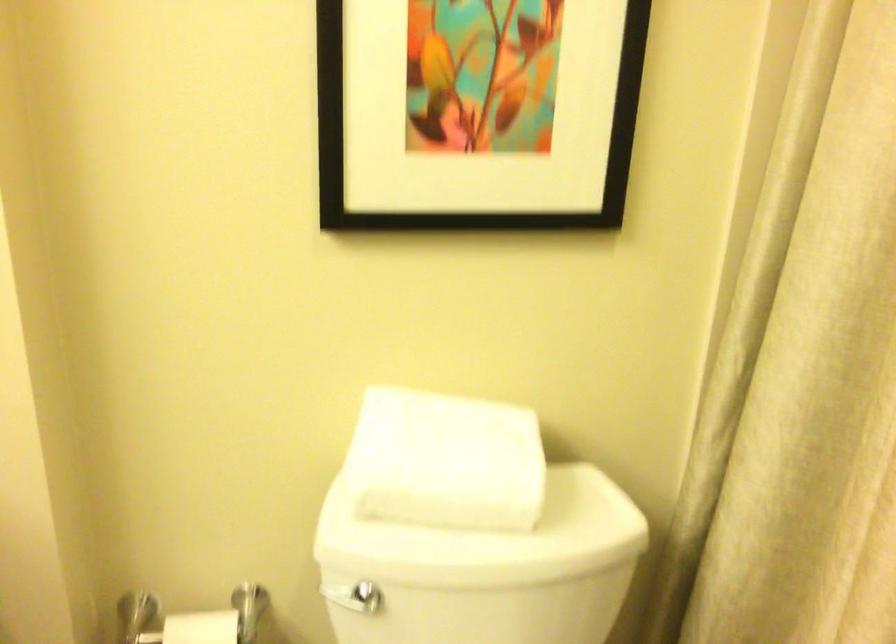
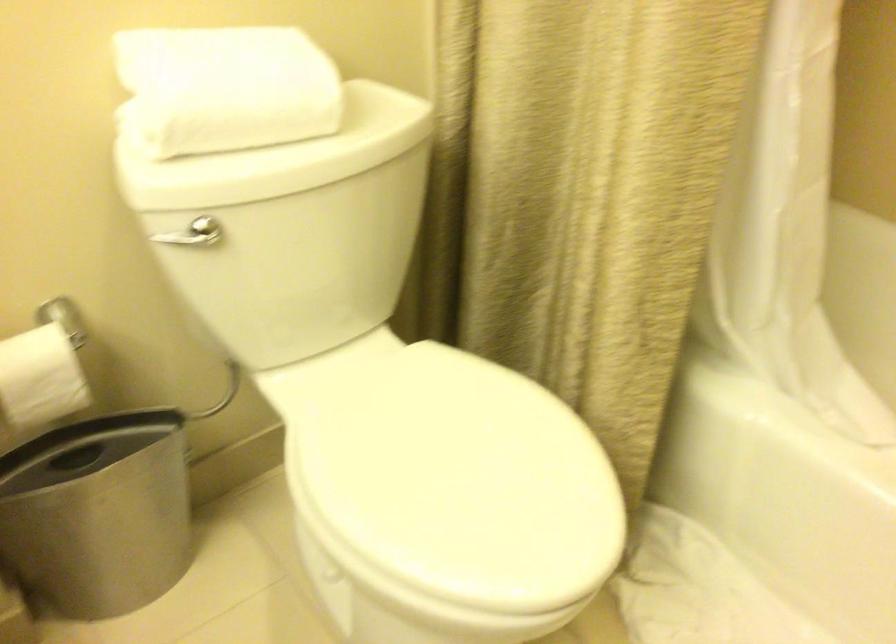
Based on the continuous images, in which direction is the camera rotating?

The rotation direction of the camera is right-down.